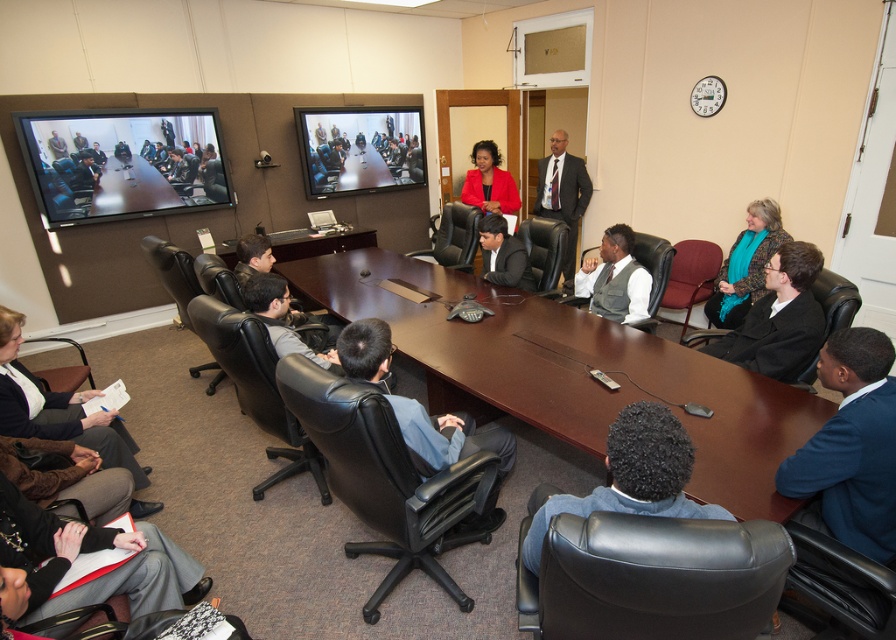
Question: Does brown wooden table at center appear on the right side of blue sweater at lower right?

Choices:
 (A) yes
 (B) no

Answer: (B)

Question: Is matte black conference table at center wider than matte black suit at center?

Choices:
 (A) no
 (B) yes

Answer: (B)

Question: Which point is farther to the camera?

Choices:
 (A) click(x=464, y=180)
 (B) click(x=745, y=250)
 (C) click(x=139, y=156)
 (D) click(x=858, y=410)

Answer: (A)

Question: Among these objects, which one is farthest from the camera?

Choices:
 (A) brown wooden table at center
 (B) teal knit sweater at right

Answer: (B)

Question: Is teal knit sweater at right above dark gray suit at center?

Choices:
 (A) yes
 (B) no

Answer: (B)

Question: Considering the real-world distances, which object is closest to the brown wooden table at center?

Choices:
 (A) blue sweater at lower right
 (B) teal knit sweater at right
 (C) matte black suit at center
 (D) brown textured sweater at lower left

Answer: (C)